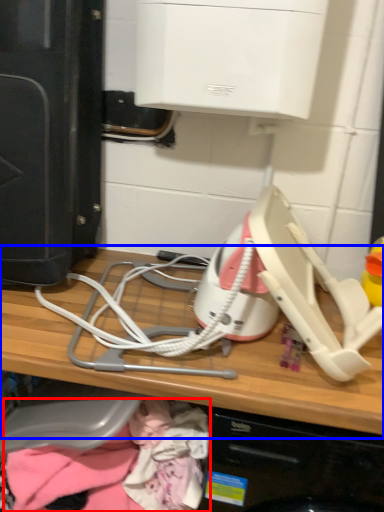
Question: Among these objects, which one is farthest to the camera, clothing (highlighted by a red box) or computer (highlighted by a blue box)?

Choices:
 (A) clothing
 (B) computer

Answer: (A)